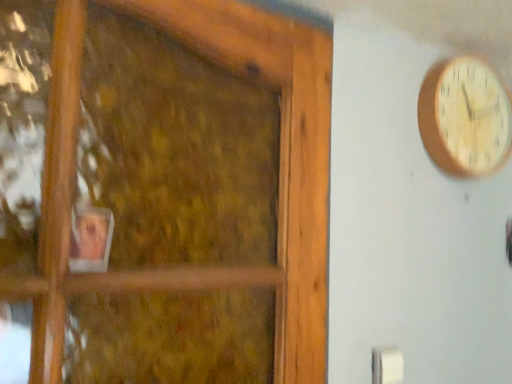
Describe the element at coordinates (465, 117) in the screenshot. I see `wooden wall clock at upper right` at that location.

Locate an element on the screen. wooden wall clock at upper right is located at coordinates (465, 117).

The width and height of the screenshot is (512, 384). I want to click on wooden wall clock at upper right, so click(465, 117).